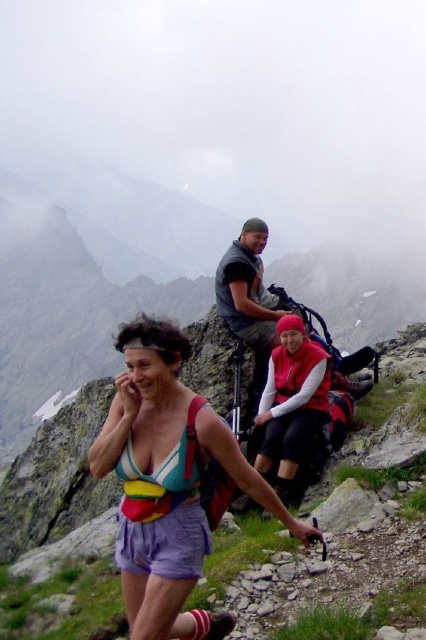
Question: Among these points, which one is nearest to the camera?

Choices:
 (A) (299, 449)
 (B) (144, 413)
 (C) (143, 474)

Answer: (C)

Question: Which of these objects is positioned farthest from the multicolored fabric bikini top at center?

Choices:
 (A) red fleece vest at center
 (B) rainbow fabric fanny pack at center

Answer: (A)

Question: Does red fleece vest at center have a lesser width compared to multicolored fabric bikini top at center?

Choices:
 (A) no
 (B) yes

Answer: (A)

Question: Is rainbow fabric fanny pack at center further to the viewer compared to red fleece vest at center?

Choices:
 (A) yes
 (B) no

Answer: (B)

Question: Estimate the real-world distances between objects in this image. Which object is farther from the red fleece vest at center?

Choices:
 (A) rainbow fabric fanny pack at center
 (B) multicolored fabric bikini top at center

Answer: (B)

Question: Can you confirm if rainbow fabric fanny pack at center is bigger than red fleece vest at center?

Choices:
 (A) no
 (B) yes

Answer: (B)